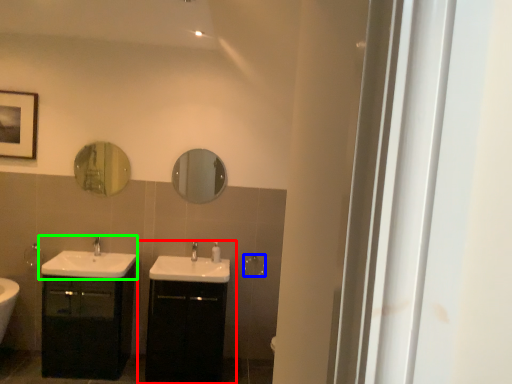
Question: Which is farther away from bathroom cabinet (highlighted by a red box)? towel bar (highlighted by a blue box) or sink (highlighted by a green box)?

Choices:
 (A) towel bar
 (B) sink

Answer: (A)